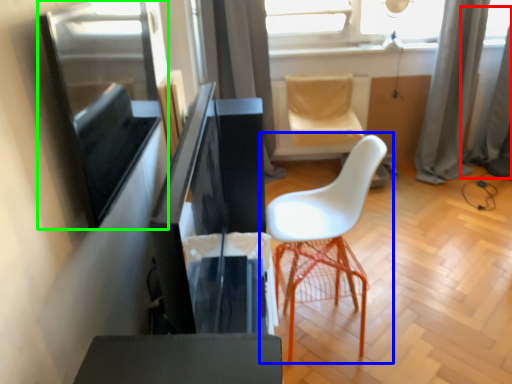
Question: Estimate the real-world distances between objects in this image. Which object is closer to curtain (highlighted by a red box), chair (highlighted by a blue box) or window screen (highlighted by a green box)?

Choices:
 (A) chair
 (B) window screen

Answer: (A)